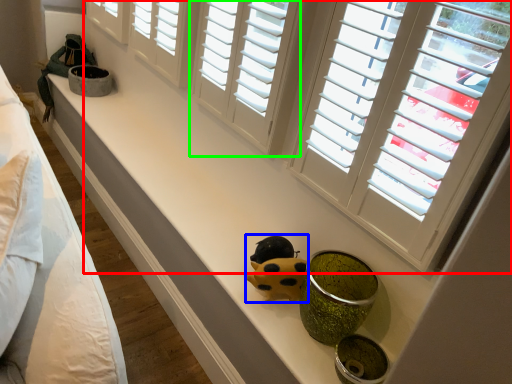
Question: Which object is the farthest from window (highlighted by a red box)? Choose among these: figurine (highlighted by a blue box) or window (highlighted by a green box).

Choices:
 (A) figurine
 (B) window

Answer: (A)